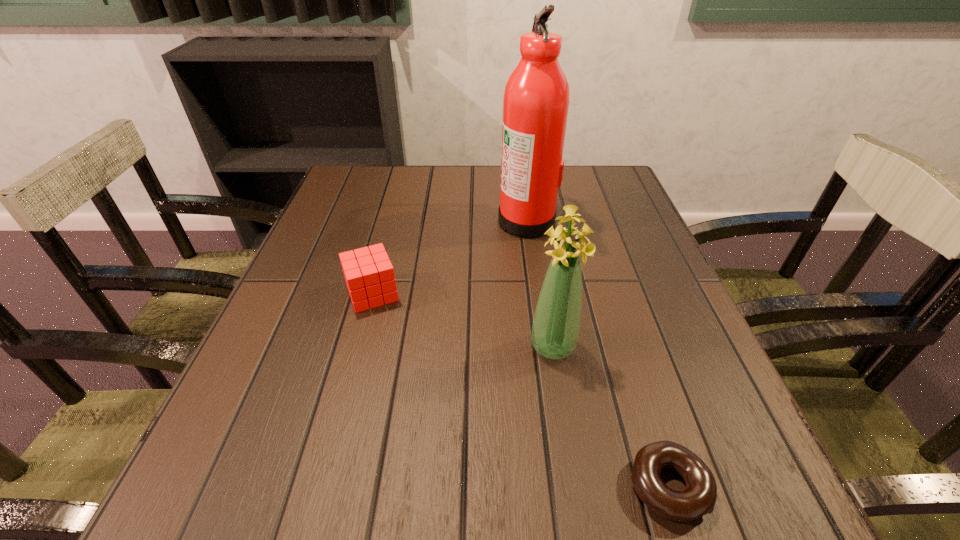
Where is `vacant space located on the label side of the fire extinguisher`? This screenshot has width=960, height=540. vacant space located on the label side of the fire extinguisher is located at coordinates (457, 220).

The image size is (960, 540). Identify the location of vacant space located on the front-facing side of the third shortest object. (567, 435).

This screenshot has width=960, height=540. I want to click on vacant region located 0.250m on the front of the cube, so click(335, 434).

Locate an element on the screen. The height and width of the screenshot is (540, 960). vacant region located on the left of the nearest object is located at coordinates (341, 486).

Where is `object that is at the far edge`? The height and width of the screenshot is (540, 960). object that is at the far edge is located at coordinates (536, 100).

You are a GUI agent. You are given a task and a screenshot of the screen. Output one action in this format:
    pyautogui.click(x=<x>, y=<y>)
    Task: Click on the object at the near edge
    Image resolution: width=960 pixels, height=540 pixels.
    Given the screenshot: What is the action you would take?
    pyautogui.click(x=699, y=497)

What are the coordinates of `object located at the left edge` in the screenshot? It's located at (369, 275).

The image size is (960, 540). Find the location of `object positioned at the right edge`. object positioned at the right edge is located at coordinates (699, 497).

I want to click on object at the near right corner, so click(699, 497).

In the image, there is a desktop. In order to click on vacant space at the far edge in this screenshot , I will do `click(560, 203)`.